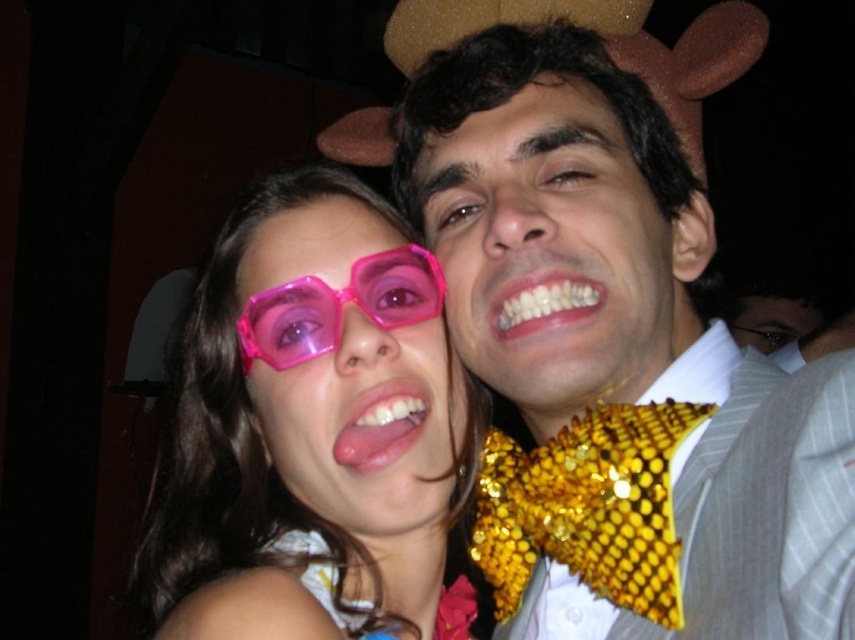
Question: Which object is closer to the camera taking this photo?

Choices:
 (A) shiny gold bow tie at center
 (B) pink plastic glasses at center
 (C) transparent plastic glasses at upper center

Answer: (A)

Question: Among these points, which one is nearest to the camera?

Choices:
 (A) (553, 531)
 (B) (310, 211)
 (C) (220, 413)

Answer: (A)

Question: Estimate the real-world distances between objects in this image. Which object is farther from the pink shiny goggles at center?

Choices:
 (A) transparent plastic glasses at upper center
 (B) pink plastic glasses at center
 (C) shiny gold bow tie at center

Answer: (C)

Question: Can you confirm if shiny gold bow tie at center is wider than pink shiny goggles at center?

Choices:
 (A) no
 (B) yes

Answer: (B)

Question: Can you confirm if shiny gold bow tie at center is smaller than pink shiny goggles at center?

Choices:
 (A) no
 (B) yes

Answer: (A)

Question: Can you confirm if transparent plastic glasses at upper center is positioned above pink plastic glasses at center?

Choices:
 (A) yes
 (B) no

Answer: (B)